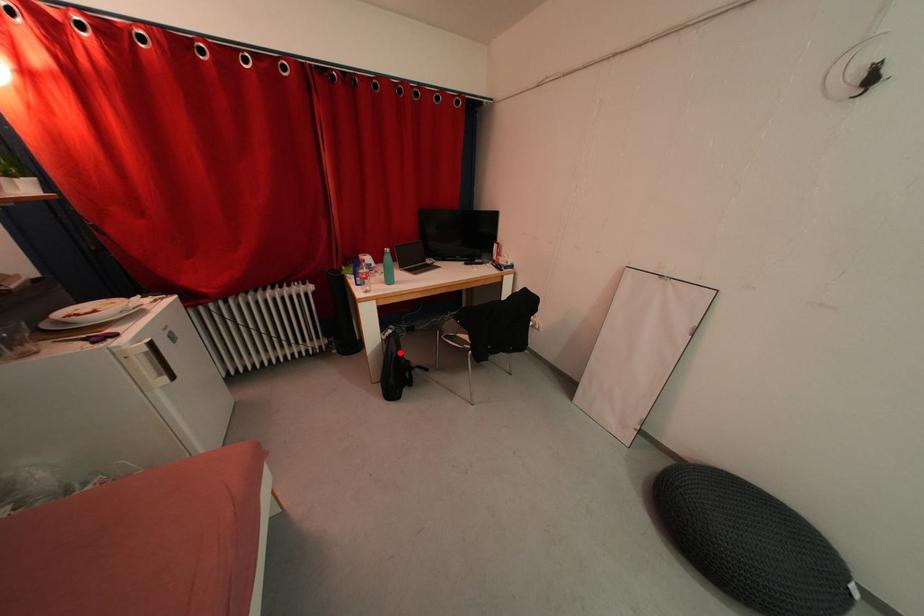
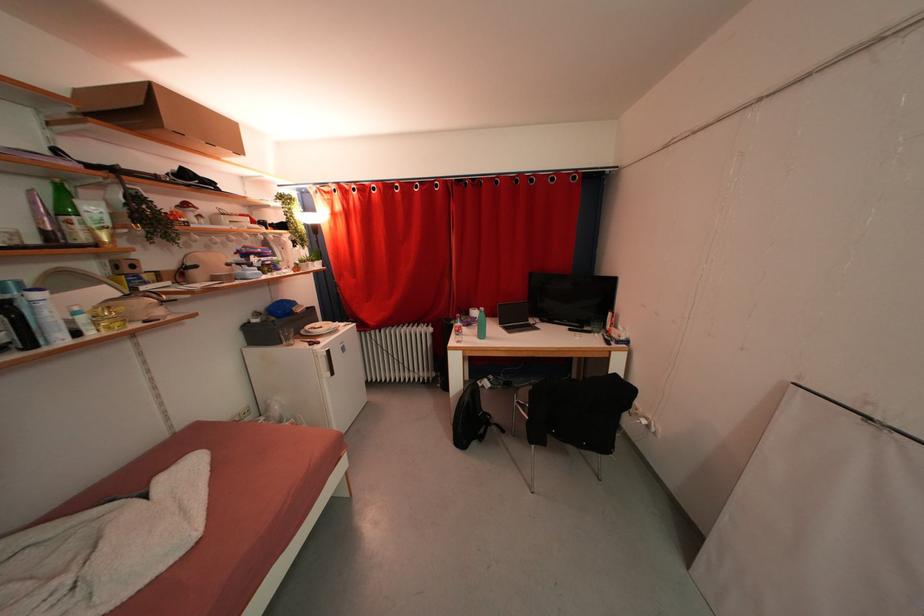
Locate, in the second image, the point that corresponds to the highlighted location in the first image.

(472, 403)